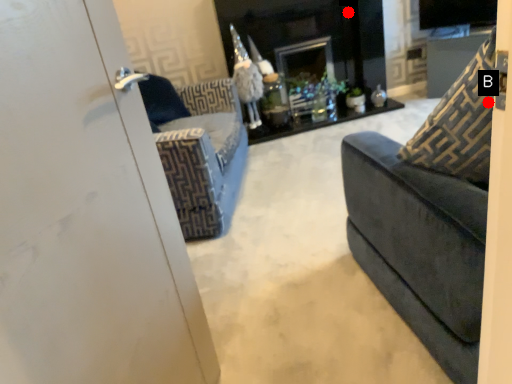
Question: Two points are circled on the image, labeled by A and B beside each circle. Which point is closer to the camera?

Choices:
 (A) A is closer
 (B) B is closer

Answer: (B)